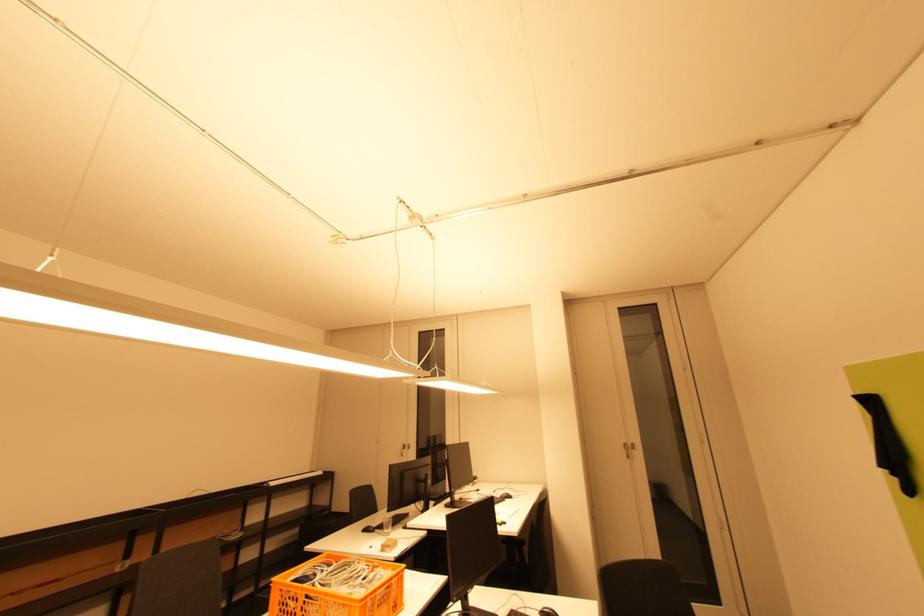
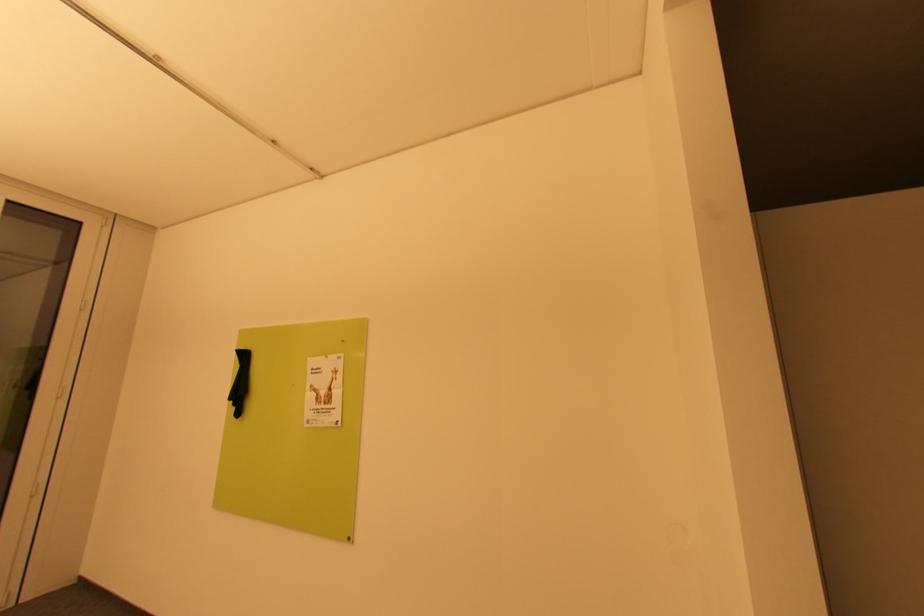
Question: The images are taken continuously from a first-person perspective. In which direction is your viewpoint rotating?

Choices:
 (A) Left
 (B) Right
 (C) Up
 (D) Down

Answer: (B)